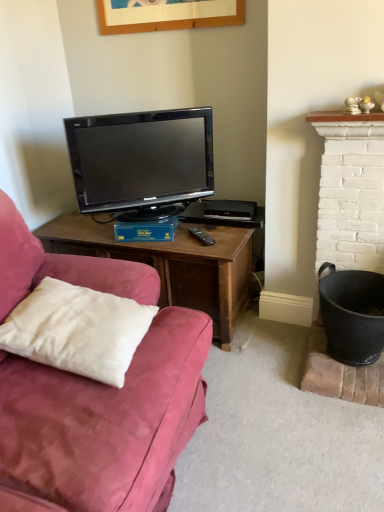
Question: Considering the relative positions of black glossy television at center and white soft pillow at lower left in the image provided, is black glossy television at center to the left of white soft pillow at lower left from the viewer's perspective?

Choices:
 (A) no
 (B) yes

Answer: (A)

Question: Is white soft pillow at lower left completely or partially inside black glossy television at center?

Choices:
 (A) no
 (B) yes

Answer: (A)

Question: From a real-world perspective, does black glossy television at center stand above white soft pillow at lower left?

Choices:
 (A) no
 (B) yes

Answer: (B)

Question: Is black glossy television at center facing away from white soft pillow at lower left?

Choices:
 (A) yes
 (B) no

Answer: (B)

Question: From a real-world perspective, does black glossy television at center sit lower than white soft pillow at lower left?

Choices:
 (A) yes
 (B) no

Answer: (B)

Question: From the image's perspective, is black glossy television at center beneath white soft pillow at lower left?

Choices:
 (A) no
 (B) yes

Answer: (A)

Question: Is white soft pillow at lower left smaller than black glossy television at center?

Choices:
 (A) no
 (B) yes

Answer: (B)

Question: Does white soft pillow at lower left appear on the right side of black glossy television at center?

Choices:
 (A) no
 (B) yes

Answer: (A)

Question: Is white soft pillow at lower left thinner than black glossy television at center?

Choices:
 (A) no
 (B) yes

Answer: (A)

Question: Is white soft pillow at lower left not near black glossy television at center?

Choices:
 (A) no
 (B) yes

Answer: (A)

Question: From a real-world perspective, is white soft pillow at lower left beneath black glossy television at center?

Choices:
 (A) yes
 (B) no

Answer: (A)

Question: Is white soft pillow at lower left completely or partially outside of black glossy television at center?

Choices:
 (A) yes
 (B) no

Answer: (A)

Question: Is point (69, 120) closer or farther from the camera than point (64, 359)?

Choices:
 (A) farther
 (B) closer

Answer: (A)